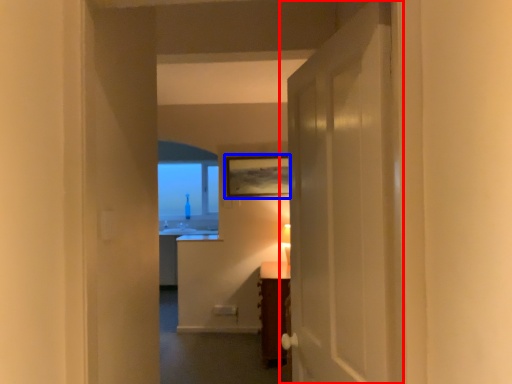
Question: Among these objects, which one is farthest to the camera, door (highlighted by a red box) or picture frame (highlighted by a blue box)?

Choices:
 (A) door
 (B) picture frame

Answer: (B)